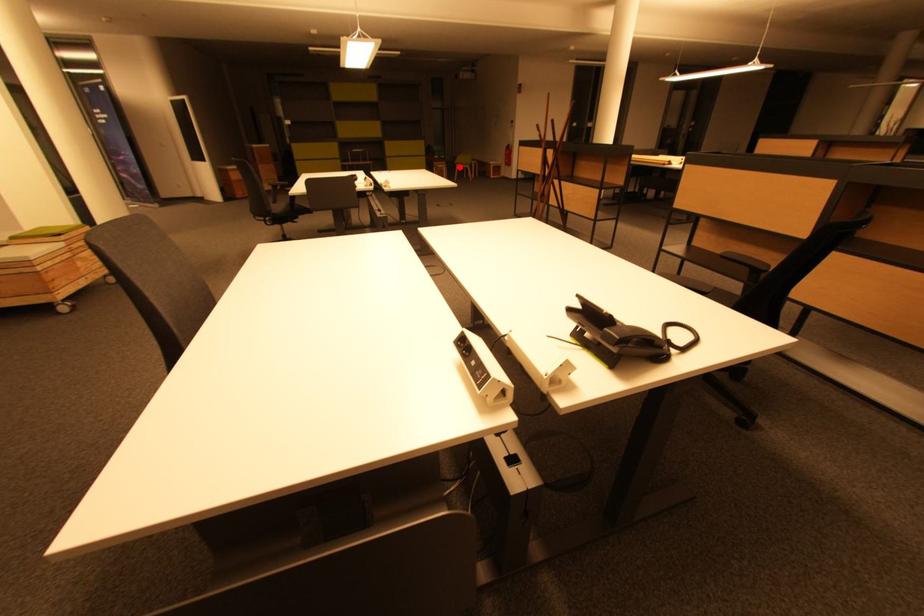
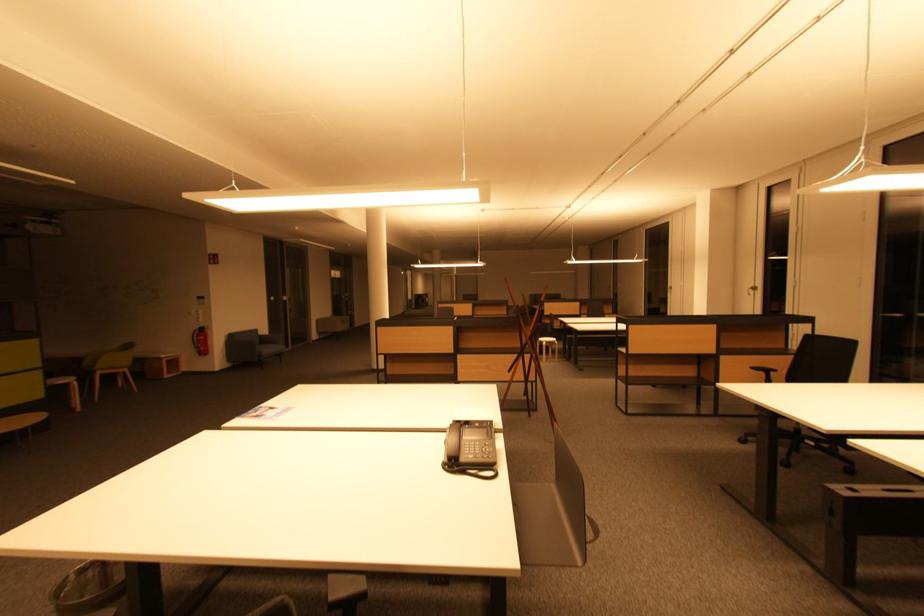
Question: I am providing you with two images of the same scene from different viewpoints. In image1, a red point is highlighted. Considering the same 3D point in image2, which of the following is correct?

Choices:
 (A) It is closer
 (B) It is farther

Answer: (A)